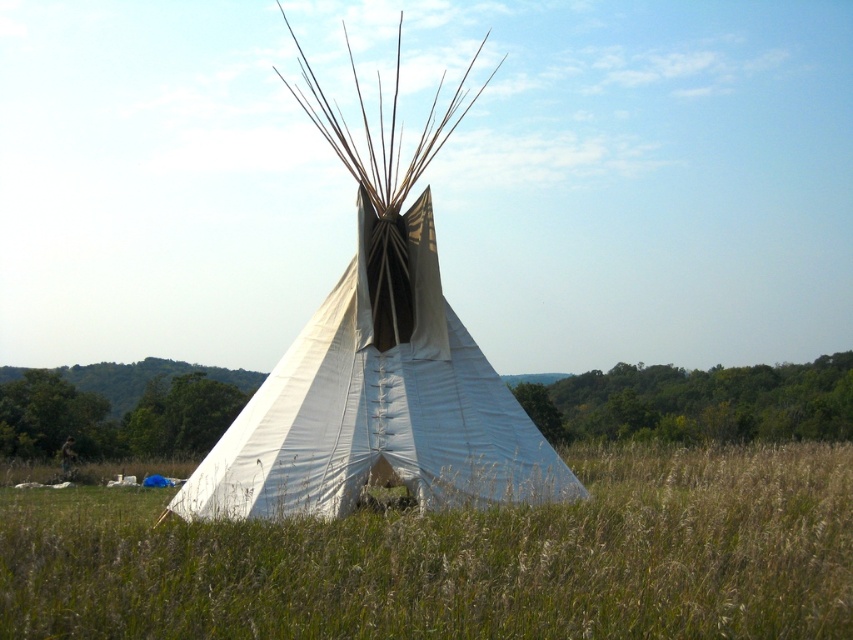
You are standing at the edge of the field and want to place a small tent exactly at the center of the green grassy field at center. According to the coordinates provided, where should you place the tent?

The green grassy field at center is located at coordinates point (x=459, y=557), so you should place the tent at those coordinates to position it exactly at the center of the green grassy field at center.

You are standing at the base of the teepee and looking towards the point marked at coordinates [459,557]. What do you see in that direction?

In the direction of the point marked at coordinates [459,557], you see the green grassy field at center.